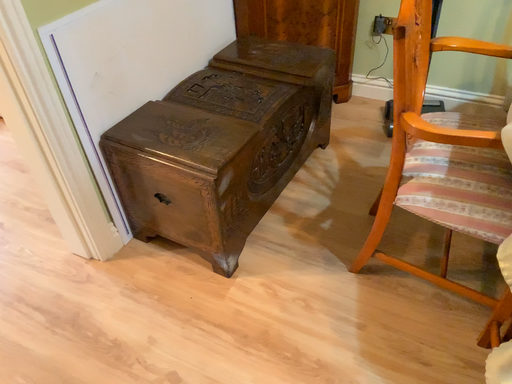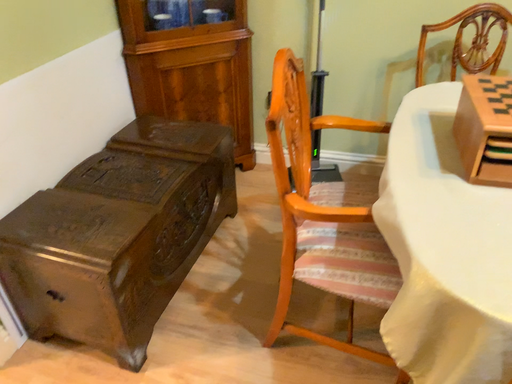
Question: How did the camera likely rotate when shooting the video?

Choices:
 (A) rotated downward
 (B) rotated upward

Answer: (B)